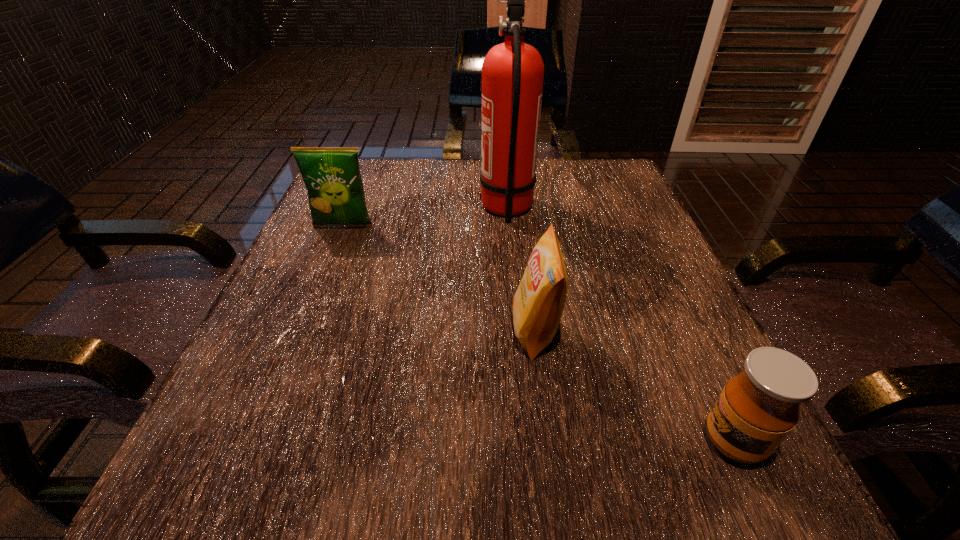
At what (x,y) coordinates should I click in order to perform the action: click on fire extinguisher. Please return your answer as a coordinate pair (x, y). Looking at the image, I should click on (512, 72).

This screenshot has height=540, width=960. What are the coordinates of `the farther crisp (potato chip)` in the screenshot? It's located at (332, 177).

Identify the location of the left crisp (potato chip). The image size is (960, 540). (332, 177).

Image resolution: width=960 pixels, height=540 pixels. Find the location of `the nearer crisp (potato chip)`. the nearer crisp (potato chip) is located at coordinates (538, 303).

Locate an element on the screen. The height and width of the screenshot is (540, 960). the second nearest object is located at coordinates (538, 303).

Locate an element on the screen. The width and height of the screenshot is (960, 540). the rightmost object is located at coordinates pos(757,409).

Find the location of a particular element. Image resolution: width=960 pixels, height=540 pixels. honey is located at coordinates (757, 409).

I want to click on vacant space located 0.080m on the handle side of the fire extinguisher, so pos(444,208).

Where is `vacant space located 0.320m on the handle side of the fire extinguisher`? This screenshot has width=960, height=540. vacant space located 0.320m on the handle side of the fire extinguisher is located at coordinates (337, 208).

Where is `free spot located 0.140m on the handle side of the fire extinguisher`? free spot located 0.140m on the handle side of the fire extinguisher is located at coordinates (418, 208).